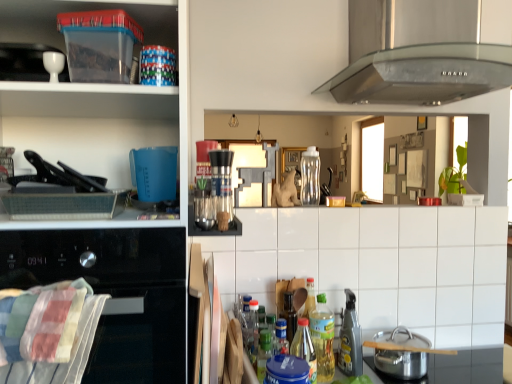
Question: Is metallic spray bottle at lower center, the 2th appliance when ordered from left to right, positioned far away from clear plastic bottle at center, the 3th bottle positioned from the bottom?

Choices:
 (A) no
 (B) yes

Answer: (A)

Question: From a real-world perspective, is metallic spray bottle at lower center, which is counted as the second appliance, starting from the top, located beneath clear plastic bottle at center, which is the 1th bottle in back-to-front order?

Choices:
 (A) yes
 (B) no

Answer: (A)

Question: Can you confirm if metallic spray bottle at lower center, the first appliance in the bottom-to-top sequence, is positioned to the right of clear plastic bottle at center, which is the 3th bottle from front to back?

Choices:
 (A) yes
 (B) no

Answer: (A)

Question: Is metallic spray bottle at lower center, which is counted as the second appliance, starting from the top, closer to the viewer compared to clear plastic bottle at center, the 3th bottle positioned from the bottom?

Choices:
 (A) yes
 (B) no

Answer: (A)

Question: Is metallic spray bottle at lower center, the 1th appliance from the right, shorter than clear plastic bottle at center, which is the 1th bottle in back-to-front order?

Choices:
 (A) no
 (B) yes

Answer: (A)

Question: In terms of height, does white tile at center, the first shelf positioned from the right, look taller or shorter compared to transparent plastic container at upper left, which appears as the third shelf when viewed from the right?

Choices:
 (A) tall
 (B) short

Answer: (B)

Question: Is white tile at center, the first shelf positioned from the right, to the left or to the right of transparent plastic container at upper left, which appears as the third shelf when viewed from the right, in the image?

Choices:
 (A) right
 (B) left

Answer: (A)

Question: From the image's perspective, is white tile at center, which is counted as the 3th shelf, starting from the left, positioned above or below transparent plastic container at upper left, which ranks as the first shelf in left-to-right order?

Choices:
 (A) above
 (B) below

Answer: (B)

Question: Is point (264, 301) closer or farther from the camera than point (5, 102)?

Choices:
 (A) closer
 (B) farther

Answer: (B)

Question: Would you say plaid fabric towel at lower left is to the left or to the right of metallic spray bottle at lower center, the 2th appliance when ordered from left to right, in the picture?

Choices:
 (A) left
 (B) right

Answer: (A)

Question: In the image, is plaid fabric towel at lower left positioned in front of or behind metallic spray bottle at lower center, the 1th appliance from the right?

Choices:
 (A) front
 (B) behind

Answer: (A)

Question: Considering the positions of point (3, 317) and point (355, 362), is point (3, 317) closer or farther from the camera than point (355, 362)?

Choices:
 (A) closer
 (B) farther

Answer: (A)

Question: In terms of size, does plaid fabric towel at lower left appear bigger or smaller than metallic spray bottle at lower center, which is counted as the second appliance, starting from the top?

Choices:
 (A) small
 (B) big

Answer: (B)

Question: From a real-world perspective, is stainless steel pot at lower right physically located above or below translucent plastic bottle at center, the 3th bottle from the top?

Choices:
 (A) above
 (B) below

Answer: (B)

Question: Considering the positions of point (411, 374) and point (310, 342), is point (411, 374) closer or farther from the camera than point (310, 342)?

Choices:
 (A) farther
 (B) closer

Answer: (B)